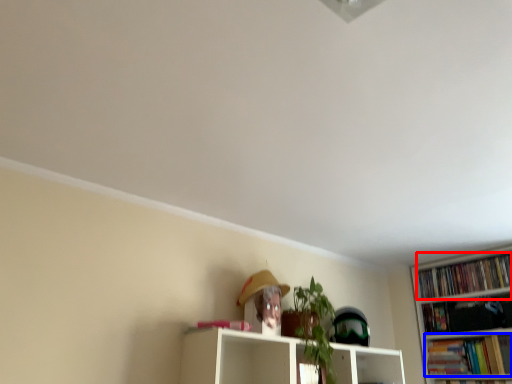
Question: Which object is closer to the camera taking this photo, book (highlighted by a red box) or book (highlighted by a blue box)?

Choices:
 (A) book
 (B) book

Answer: (B)